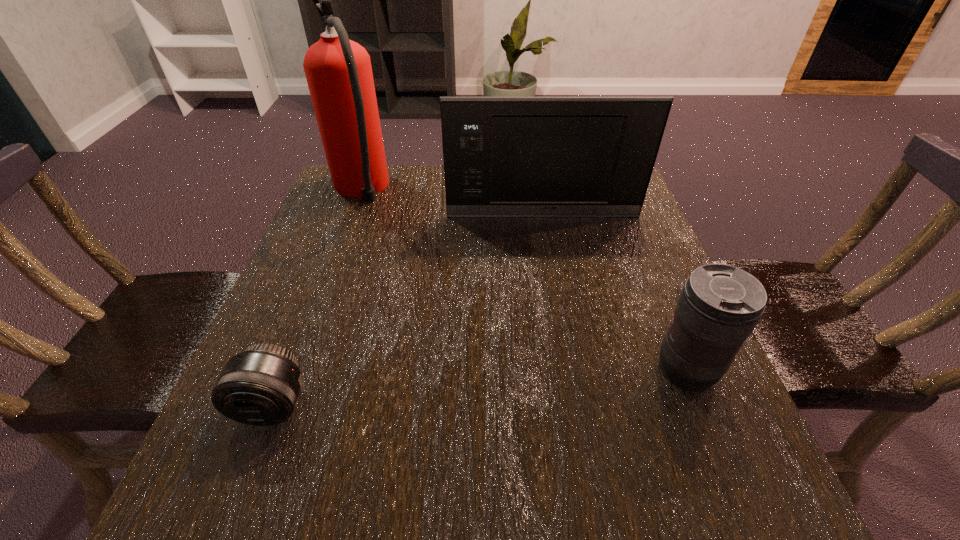
At what (x,y) coordinates should I click in order to perform the action: click on free spot between the fire extinguisher and the shorter telephoto lens. Please return your answer as a coordinate pair (x, y). The height and width of the screenshot is (540, 960). Looking at the image, I should click on (317, 298).

You are a GUI agent. You are given a task and a screenshot of the screen. Output one action in this format:
    pyautogui.click(x=<x>, y=<y>)
    Task: Click on the blank region between the tallest object and the taller telephoto lens
    The image size is (960, 540).
    Given the screenshot: What is the action you would take?
    pyautogui.click(x=523, y=280)

Locate an element on the screen. free spot between the shortest object and the right telephoto lens is located at coordinates (479, 387).

Select which object appears as the third closest to the microwave oven. Please provide its 2D coordinates. Your answer should be formatted as a tuple, i.e. [(x, y)], where the tuple contains the x and y coordinates of a point satisfying the conditions above.

[(260, 386)]

Find the location of a particular element. Image resolution: width=960 pixels, height=540 pixels. object that is the closest to the right telephoto lens is located at coordinates (503, 156).

The width and height of the screenshot is (960, 540). In order to click on free space in the image that satisfies the following two spatial constraints: 1. on the side of the taller telephoto lens where the control switches are located; 2. on the front-facing side of the shortest object in this screenshot , I will do `click(700, 405)`.

At what (x,y) coordinates should I click in order to perform the action: click on free point that satisfies the following two spatial constraints: 1. on the side of the right telephoto lens where the control switches are located; 2. on the front-facing side of the shortest object. Please return your answer as a coordinate pair (x, y). Looking at the image, I should click on (700, 405).